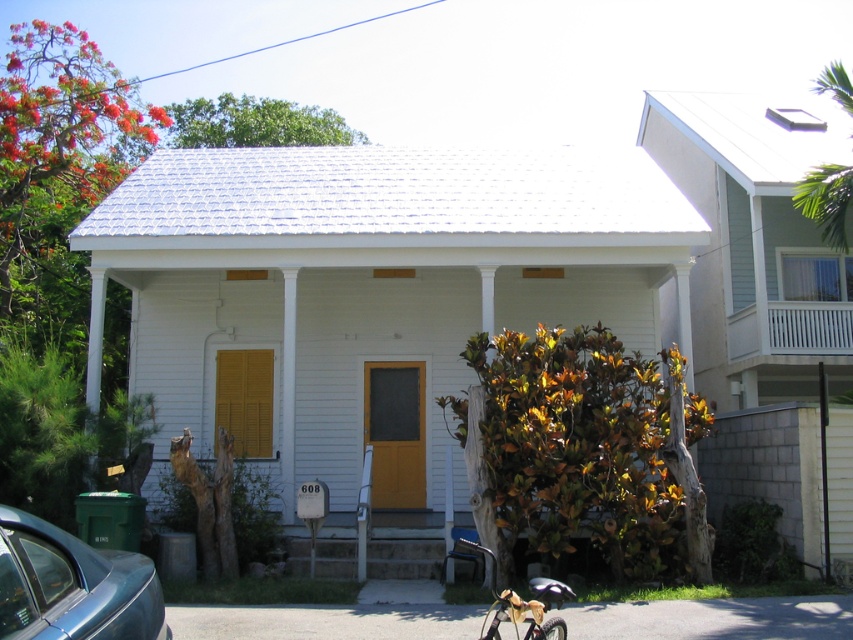
You are standing at the entrance of the house and want to park your metallic gold bicycle at lower center near the white painted wood porch at upper right. Based on their positions, which direction should you move the bicycle to get it closer to the porch?

The white painted wood porch at upper right is to the right of the metallic gold bicycle at lower center, so you should move the bicycle to the right to get it closer to the porch.

You are a delivery person trying to park your metallic blue car at lower left near the house. The white painted wood porch at upper right is in the way. Can you park your car there without moving the porch?

The metallic blue car at lower left occupies less space than the white painted wood porch at upper right. Therefore, the car can be parked there as it requires less space than the porch occupies.

You are standing in front of the house and notice two points marked on the image. The first point is at coordinates point (25,538) and the second is at point (755,342). Which point is closer to you?

Point (25,538) is closer to the camera than point (755,342).